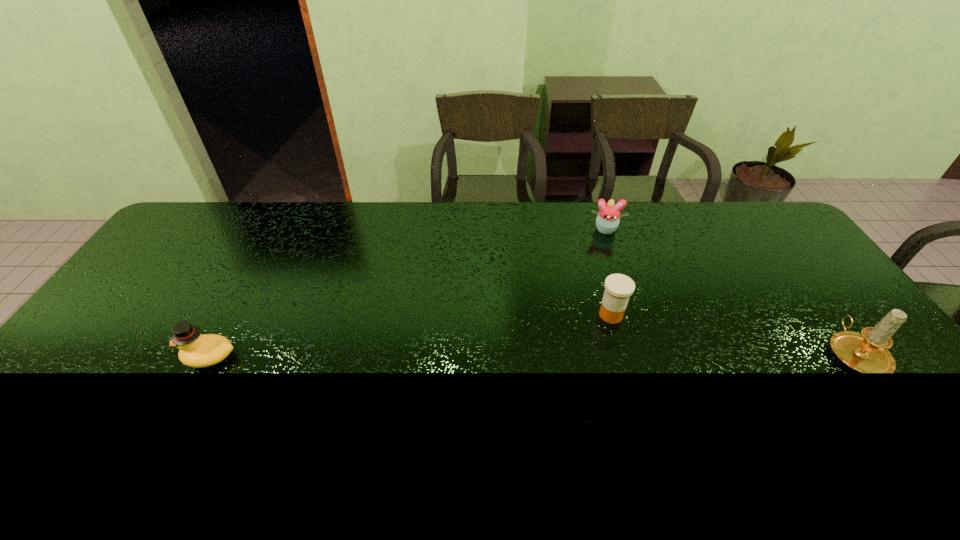
The height and width of the screenshot is (540, 960). Identify the location of empty location between the farthest object and the medicine. (608, 272).

You are a GUI agent. You are given a task and a screenshot of the screen. Output one action in this format:
    pyautogui.click(x=<x>, y=<y>)
    Task: Click on the empty location between the cupcake and the medicine
    This screenshot has height=540, width=960.
    Given the screenshot: What is the action you would take?
    point(608,272)

Identify the location of vacant area that lies between the cupcake and the third nearest object. (608, 272).

Point out which object is positioned as the third nearest to the cupcake. Please provide its 2D coordinates. Your answer should be formatted as a tuple, i.e. [(x, y)], where the tuple contains the x and y coordinates of a point satisfying the conditions above.

[(196, 350)]

Locate which object is the closest to the medicine. Please provide its 2D coordinates. Your answer should be formatted as a tuple, i.e. [(x, y)], where the tuple contains the x and y coordinates of a point satisfying the conditions above.

[(607, 221)]

Identify the location of vacant space that satisfies the following two spatial constraints: 1. on the front side of the farthest object; 2. on the left side of the candle. This screenshot has width=960, height=540. tap(646, 353).